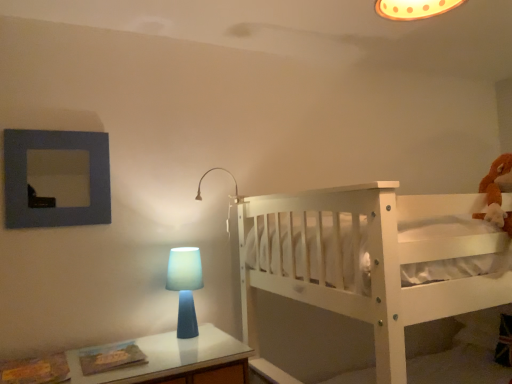
Question: Does matte white lamp at upper center come behind blue matte picture frame at upper left?

Choices:
 (A) yes
 (B) no

Answer: (A)

Question: Considering the relative sizes of matte white lamp at upper center and blue matte picture frame at upper left in the image provided, is matte white lamp at upper center smaller than blue matte picture frame at upper left?

Choices:
 (A) no
 (B) yes

Answer: (B)

Question: From the image's perspective, would you say matte white lamp at upper center is positioned over blue matte picture frame at upper left?

Choices:
 (A) no
 (B) yes

Answer: (A)

Question: Considering the relative positions of matte white lamp at upper center and blue matte picture frame at upper left in the image provided, is matte white lamp at upper center in front of blue matte picture frame at upper left?

Choices:
 (A) yes
 (B) no

Answer: (B)

Question: Is matte white lamp at upper center facing away from blue matte picture frame at upper left?

Choices:
 (A) no
 (B) yes

Answer: (A)

Question: Is matte white lamp at upper center wider than blue matte picture frame at upper left?

Choices:
 (A) no
 (B) yes

Answer: (B)

Question: Is the surface of blue matte table lamp at center in direct contact with white wooden bunk bed at right?

Choices:
 (A) no
 (B) yes

Answer: (A)

Question: From the image's perspective, is blue matte table lamp at center located beneath white wooden bunk bed at right?

Choices:
 (A) no
 (B) yes

Answer: (A)

Question: Is blue matte table lamp at center at the right side of white wooden bunk bed at right?

Choices:
 (A) no
 (B) yes

Answer: (A)

Question: Can you confirm if blue matte table lamp at center is positioned to the left of white wooden bunk bed at right?

Choices:
 (A) no
 (B) yes

Answer: (B)

Question: Is blue matte table lamp at center oriented towards white wooden bunk bed at right?

Choices:
 (A) yes
 (B) no

Answer: (B)

Question: From a real-world perspective, is blue matte table lamp at center over white wooden bunk bed at right?

Choices:
 (A) no
 (B) yes

Answer: (B)

Question: From a real-world perspective, is matte white lamp at upper center positioned over blue matte table lamp at center based on gravity?

Choices:
 (A) no
 (B) yes

Answer: (B)